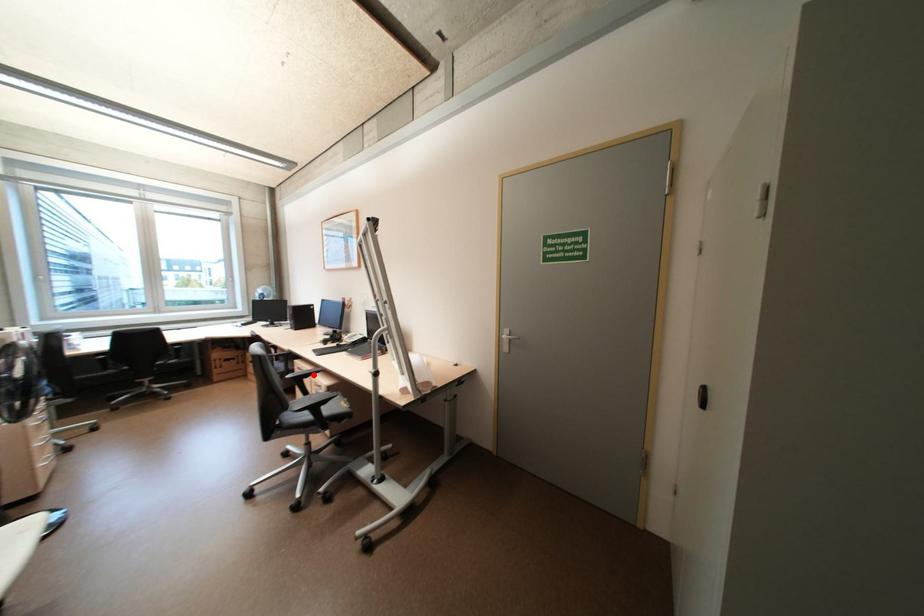
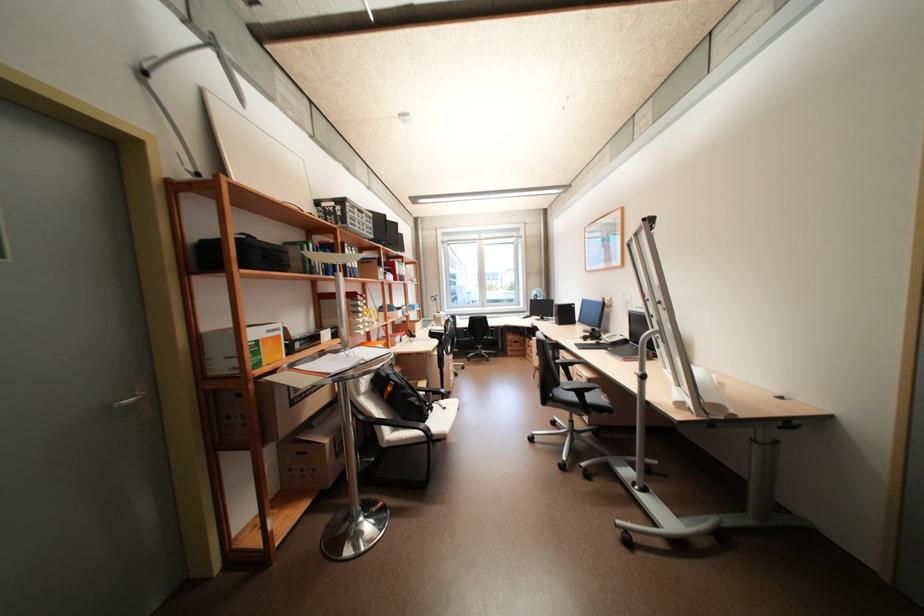
Question: I am providing you with two images of the same scene from different viewpoints. Given a red point in image1, look at the same physical point in image2. Is it:

Choices:
 (A) Closer to the viewpoint
 (B) Farther from the viewpoint

Answer: (A)